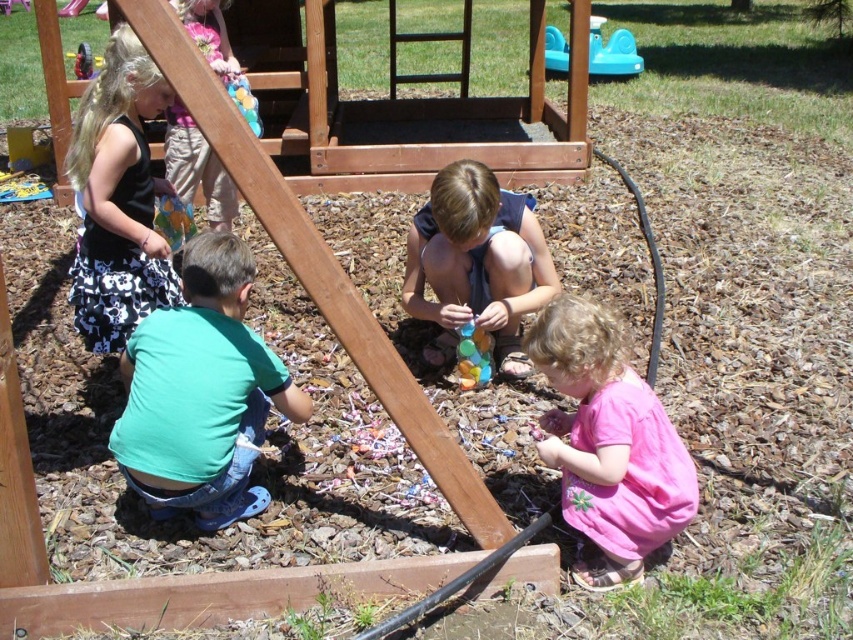
You are a photographer setting up a shot of the playground scene. You want to focus on the green matte shirt at lower left and the teal plastic toy at upper right. Which object should you adjust your camera focus on first if you want to capture both in sharp detail?

The green matte shirt at lower left is closer to the viewer than the teal plastic toy at upper right, so you should focus on the green matte shirt at lower left first to ensure both are in sharp detail.

You are a parent trying to locate your child wearing a green matte shirt at lower left. From your position near the wooden swing at upper left, which direction should you look to find the child?

The green matte shirt at lower left is taller than the wooden swing at upper left, so you should look upwards from the wooden swing at upper left to find the child wearing the green matte shirt at lower left.

In the scene shown: You are taking a photo of the playground scene. There are two points marked in the image at coordinates point (x=207, y=467) and point (x=82, y=58). Which point will appear larger in your photo?

Point (x=207, y=467) is closer to the camera than point (x=82, y=58), so it will appear larger in the photo.